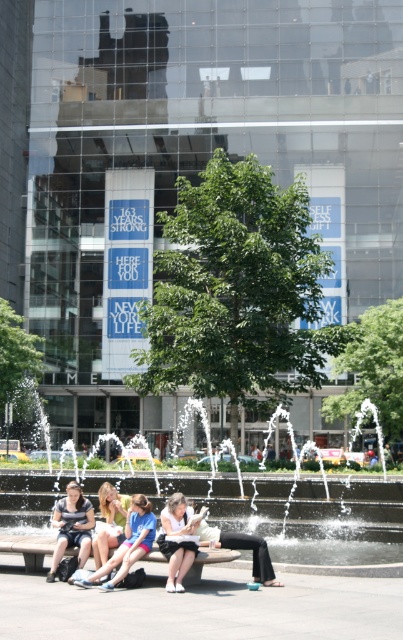
Question: Which of the following is the farthest from the observer?

Choices:
 (A) smooth concrete bench at center
 (B) denim shorts at lower left
 (C) blonde hair at center
 (D) light beige pants at center

Answer: (A)

Question: Can you confirm if black stone fountain at center is thinner than denim jacket at lower left?

Choices:
 (A) yes
 (B) no

Answer: (B)

Question: Is white cotton shirt at center below light beige pants at center?

Choices:
 (A) no
 (B) yes

Answer: (A)

Question: In this image, where is white cotton shirt at center located relative to light beige pants at center?

Choices:
 (A) right
 (B) left

Answer: (B)

Question: Considering the real-world distances, which object is closest to the light beige pants at center?

Choices:
 (A) denim jacket at lower left
 (B) white cotton shirt at center
 (C) denim shorts at lower left

Answer: (B)

Question: Estimate the real-world distances between objects in this image. Which object is closer to the blonde hair at center?

Choices:
 (A) black stone fountain at center
 (B) white cotton shirt at center

Answer: (B)